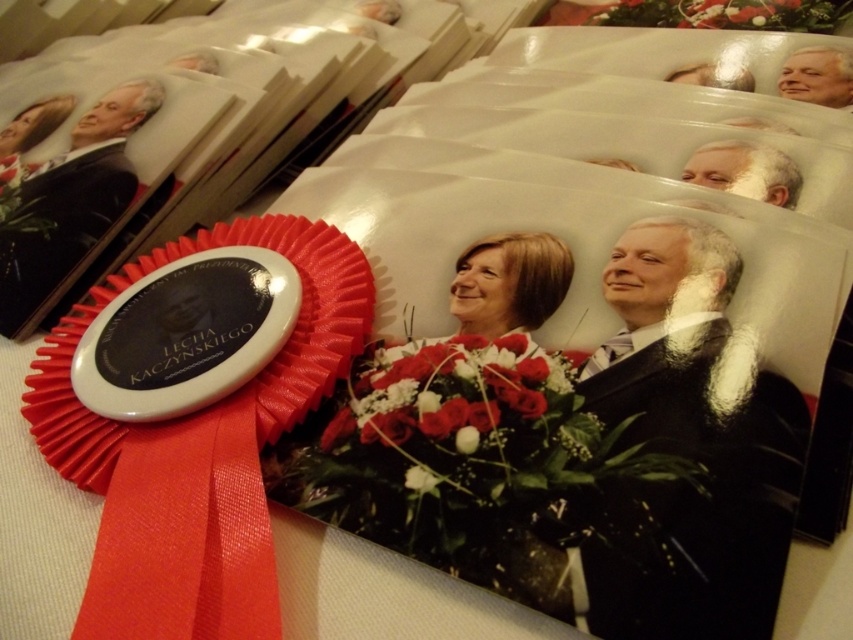
You are a photographer who needs to adjust the lighting between the matte black portrait at upper left and the smooth white face at upper right. The minimum distance required for proper lighting adjustment is 36 inches. Can you perform the adjustment without moving the subjects?

The distance between the matte black portrait at upper left and the smooth white face at upper right is 37.41 inches, which exceeds the minimum requirement of 36 inches. Therefore, the photographer can adjust the lighting without moving the subjects.

You are a photographer trying to capture a closeup of the text on the badge attached to the red ribbon in the foreground. The text is located at point (171, 620). If your camera can focus on objects within 20 inches from the lens, will you be able to capture the text clearly?

The point (171, 620) is 20.97 inches away from the viewer. Since this distance is slightly beyond the camera lens focus range of 20 inches, capturing the text clearly might be difficult.

You are a photographer analyzing the image. You notice two points marked in the scene. The first point is at coordinates point (61, 445) and the second is at point (418, 369). Which of these points is closer to the camera?

Point (61, 445) is closer to the camera than point (418, 369).